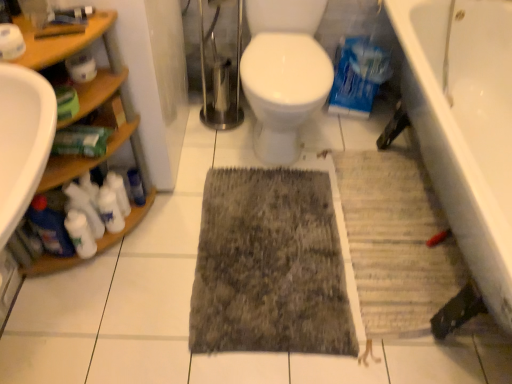
Question: Considering the relative sizes of white matte cleaning products at lower left, which is counted as the 3th cleaning product, starting from the left, and white matte toilet paper at upper left, the 1th toilet paper when ordered from front to back, in the image provided, is white matte cleaning products at lower left, which is counted as the 3th cleaning product, starting from the left, smaller than white matte toilet paper at upper left, the 1th toilet paper when ordered from front to back,?

Choices:
 (A) yes
 (B) no

Answer: (B)

Question: From a real-world perspective, does white matte cleaning products at lower left, which is counted as the 3th cleaning product, starting from the left, sit lower than white matte toilet paper at upper left, acting as the second toilet paper starting from the right?

Choices:
 (A) yes
 (B) no

Answer: (A)

Question: Is white matte cleaning products at lower left, which is the second cleaning product in right-to-left order, facing towards white matte toilet paper at upper left, acting as the second toilet paper starting from the right?

Choices:
 (A) no
 (B) yes

Answer: (A)

Question: From the image's perspective, is white matte cleaning products at lower left, which is the second cleaning product in right-to-left order, under white matte toilet paper at upper left, the 1th toilet paper when ordered from front to back?

Choices:
 (A) yes
 (B) no

Answer: (A)

Question: Does white matte cleaning products at lower left, which is the second cleaning product in right-to-left order, appear on the right side of white matte toilet paper at upper left, the 1th toilet paper when ordered from front to back?

Choices:
 (A) no
 (B) yes

Answer: (B)

Question: Is white matte cleaning products at lower left, which is counted as the 3th cleaning product, starting from the left, bigger or smaller than white matte cleaning product at left, placed as the 4th cleaning product when sorted from left to right?

Choices:
 (A) small
 (B) big

Answer: (B)

Question: Is white matte cleaning products at lower left, which is counted as the 3th cleaning product, starting from the left, wider or thinner than white matte cleaning product at left, the 1th cleaning product from the right?

Choices:
 (A) thin
 (B) wide

Answer: (B)

Question: From the image's perspective, is white matte cleaning products at lower left, which is the second cleaning product in right-to-left order, above or below white matte cleaning product at left, the 1th cleaning product from the right?

Choices:
 (A) below
 (B) above

Answer: (A)

Question: From a real-world perspective, is white matte cleaning products at lower left, which is counted as the 3th cleaning product, starting from the left, physically located above or below white matte cleaning product at left, the 1th cleaning product from the right?

Choices:
 (A) above
 (B) below

Answer: (B)

Question: Based on their sizes in the image, would you say dark gray textured rug at center is bigger or smaller than white matte cleaning product at lower left, acting as the 2th cleaning product starting from the left?

Choices:
 (A) small
 (B) big

Answer: (B)

Question: Relative to white matte cleaning product at lower left, acting as the 2th cleaning product starting from the left, is dark gray textured rug at center in front or behind?

Choices:
 (A) front
 (B) behind

Answer: (B)

Question: In terms of width, does dark gray textured rug at center look wider or thinner when compared to white matte cleaning product at lower left, the 3th cleaning product viewed from the right?

Choices:
 (A) thin
 (B) wide

Answer: (B)

Question: Visually, is dark gray textured rug at center positioned to the left or to the right of white matte cleaning product at lower left, the 3th cleaning product viewed from the right?

Choices:
 (A) right
 (B) left

Answer: (A)

Question: From a real-world perspective, is white matte toilet paper at upper left, the first toilet paper viewed from the back, physically located above or below blue glossy bottle at left, the 4th cleaning product viewed from the right?

Choices:
 (A) above
 (B) below

Answer: (A)

Question: Relative to blue glossy bottle at left, the 4th cleaning product viewed from the right, is white matte toilet paper at upper left, which is the 2th toilet paper in front-to-back order, in front or behind?

Choices:
 (A) front
 (B) behind

Answer: (A)